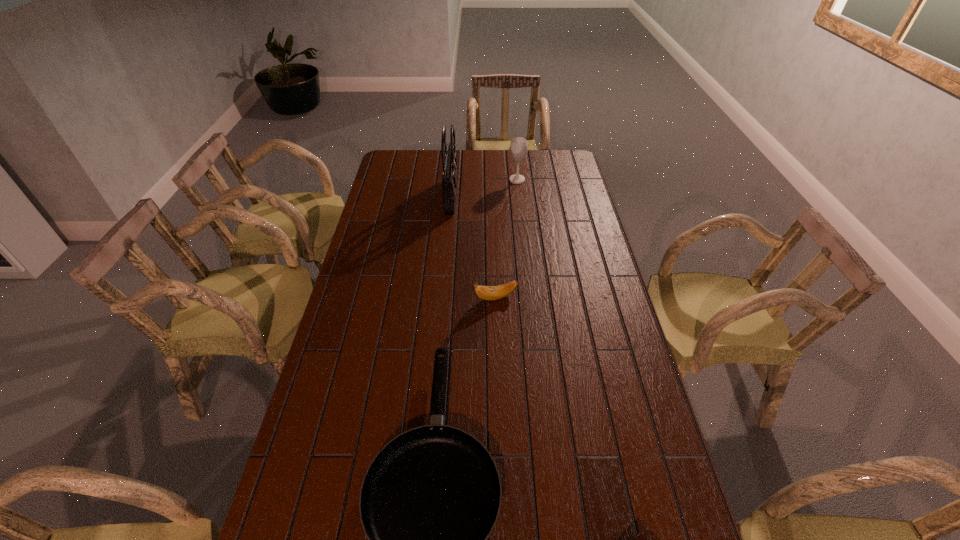
The image size is (960, 540). Identify the location of free space at the far left corner of the desktop. (390, 158).

In the image, there is a desktop. What are the coordinates of `vacant region at the far right corner` in the screenshot? It's located at (559, 162).

I want to click on vacant space that is in between the tallest object and the third farthest object, so click(473, 246).

I want to click on vacant space that is in between the third farthest object and the handbag, so click(x=473, y=246).

Where is `unoccupied position between the tallest object and the third nearest object`? The height and width of the screenshot is (540, 960). unoccupied position between the tallest object and the third nearest object is located at coordinates coord(473,246).

What are the coordinates of `the closest object relative to the frying pan` in the screenshot? It's located at (638, 539).

Identify which object is located as the nearest to the frying pan. Please provide its 2D coordinates. Your answer should be formatted as a tuple, i.e. [(x, y)], where the tuple contains the x and y coordinates of a point satisfying the conditions above.

[(638, 539)]

At what (x,y) coordinates should I click in order to perform the action: click on vacant space that satisfies the following two spatial constraints: 1. with an open clasp on the front of the third nearest object; 2. on the left side of the handbag. Please return your answer as a coordinate pair (x, y). This screenshot has width=960, height=540. Looking at the image, I should click on (443, 298).

This screenshot has width=960, height=540. Identify the location of vacant space that satisfies the following two spatial constraints: 1. on the front side of the wineglass; 2. with an open clasp on the front of the tallest object. (518, 195).